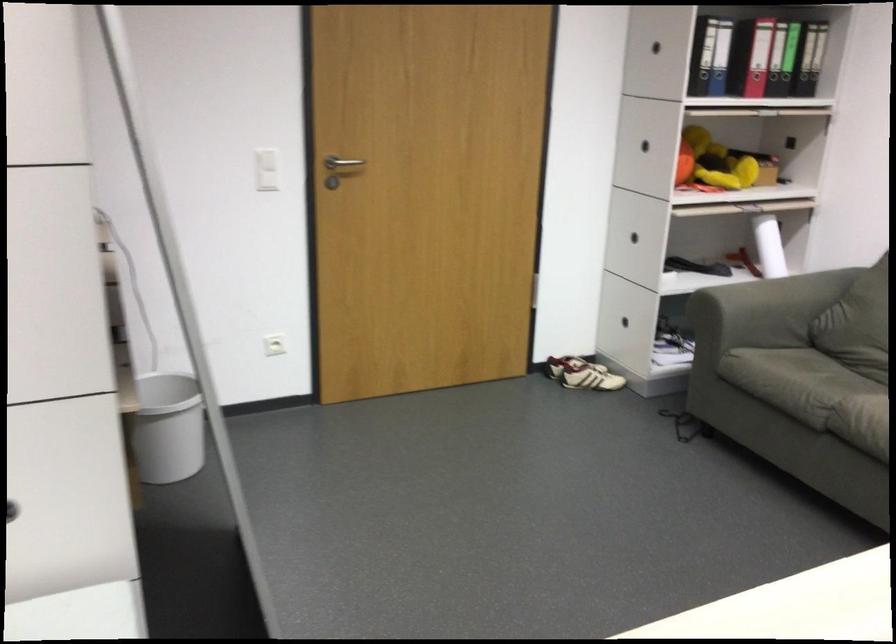
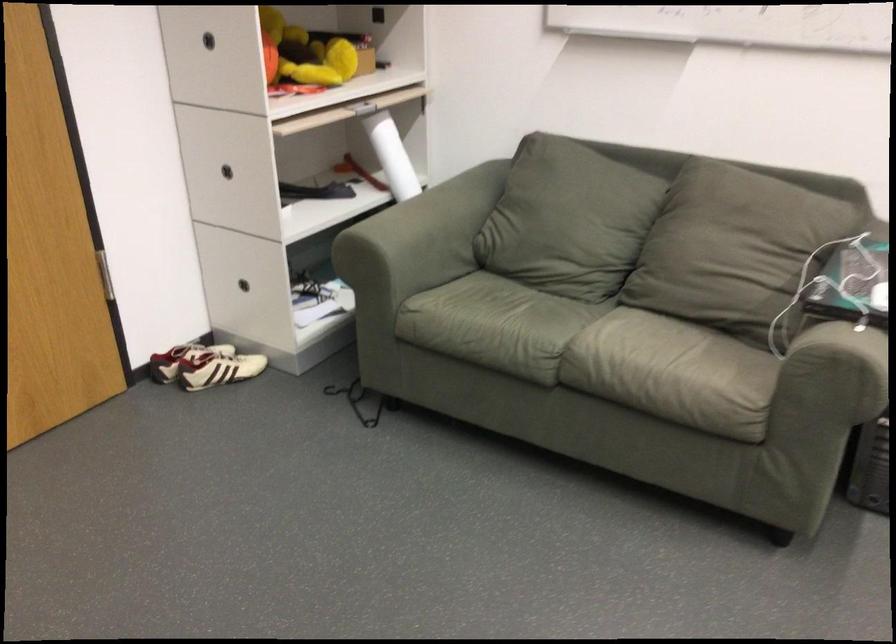
Locate, in the second image, the point that corresponds to point 796,377 in the first image.

(495, 325)